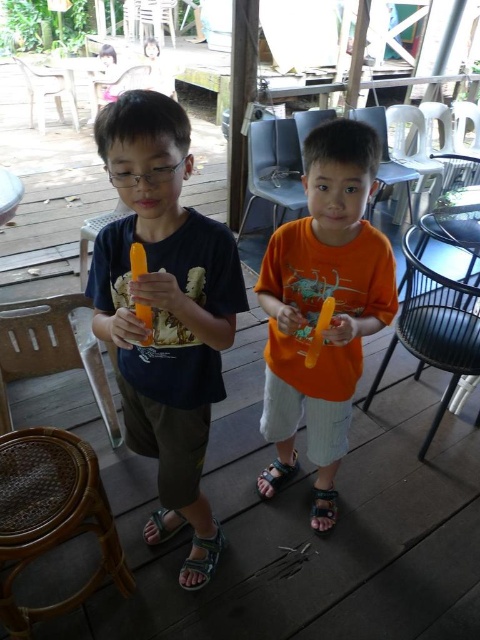
You are standing at point (325, 150) and want to walk to point (155, 374). Based on the scene description, will you have to walk towards the front or the back of the deck?

Based on the scene description, point (155, 374) is behind point (325, 150). Therefore, to walk from point (325, 150) to point (155, 374), you would need to walk towards the back of the deck.

You are standing at the origin point in the scene and want to locate the matte black shirt at left. What are its coordinates?

The coordinates of the matte black shirt at left are at point (164, 296).

From the picture: You are a photographer standing at the edge of the deck. You need to capture a photo that includes both the matte black shirt at left and the green fabric sandal at lower center. Considering the distance between them, will you need to zoom in or zoom out to ensure both are fully visible in the frame?

The distance between the matte black shirt at left and the green fabric sandal at lower center is 24.40 inches. To ensure both are fully visible in the frame, you would need to zoom out slightly to accommodate the space between them.